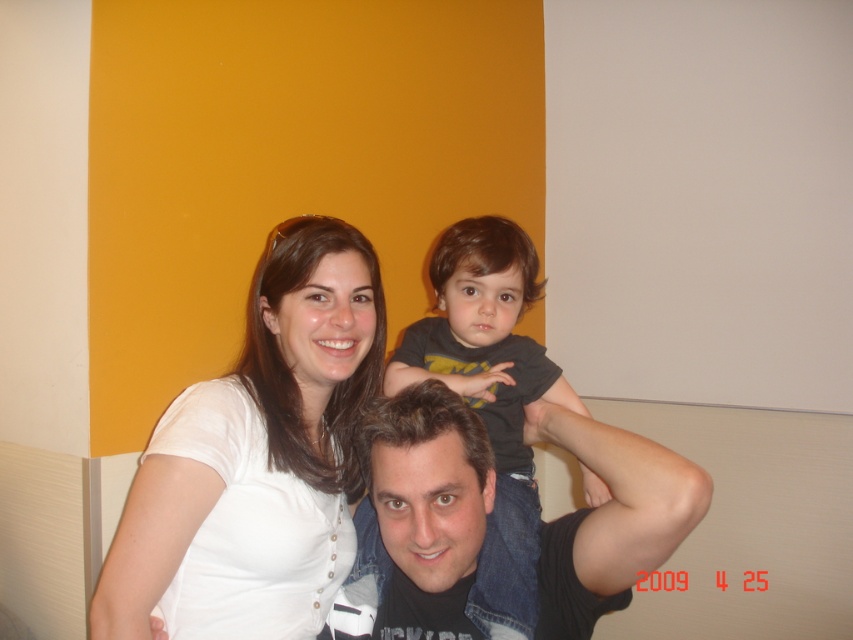
You are a photographer setting up a shoot in the described scene. You need to place a small prop exactly at the coordinates mentioned in the objects description. Where should you position the prop relative to the white matte shirt at upper center?

The white matte shirt at upper center is located at point (312, 346), so you should position the prop at those coordinates relative to the white matte shirt at upper center.

Looking at this image, you are a photographer standing 1 meter away from the white matte shirt at upper left. Can you take a clear photo of it without moving closer?

The white matte shirt at upper left is 1.01 meters away from the viewer, so you can take a clear photo without moving closer since the distance is just over 1 meter.